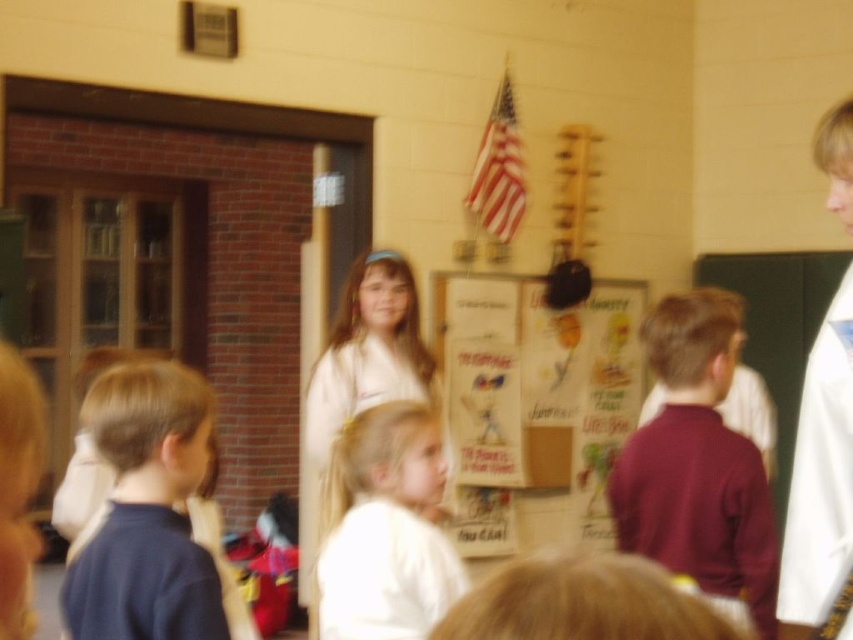
Does white cloth at upper right appear on the right side of white cotton dress at center?

Yes, white cloth at upper right is to the right of white cotton dress at center.

Between point (828, 570) and point (328, 403), which one is positioned behind?

The point (328, 403) is more distant.

At what (x,y) coordinates should I click in order to perform the action: click on white cloth at upper right. Please return your answer as a coordinate pair (x, y). Looking at the image, I should click on (820, 477).

Can you confirm if maroon sweater at center is wider than dark blue shirt at lower left?

Indeed, maroon sweater at center has a greater width compared to dark blue shirt at lower left.

Is point (730, 524) positioned in front of point (106, 582)?

That is False.

Find the location of a particular element. maroon sweater at center is located at coordinates (697, 461).

The image size is (853, 640). What do you see at coordinates (538, 387) in the screenshot?
I see `cardboard poster at center` at bounding box center [538, 387].

Does cardboard poster at center have a smaller size compared to white cotton dress at center?

No.

Between point (561, 488) and point (317, 500), which one is positioned in front?

Point (317, 500) is in front.

Where is `cardboard poster at center`? cardboard poster at center is located at coordinates (538, 387).